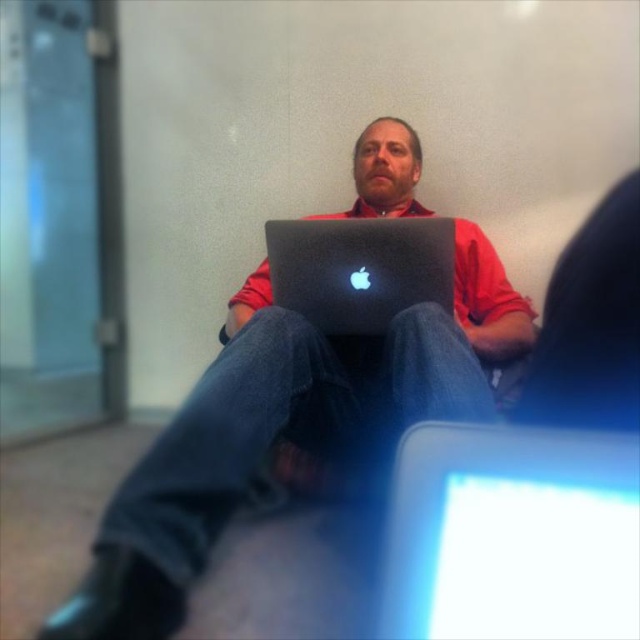
Is matte black laptop at center below satin black laptop at center?

Yes, matte black laptop at center is below satin black laptop at center.

Between matte black laptop at center and satin black laptop at center, which one appears on the right side from the viewer's perspective?

From the viewer's perspective, satin black laptop at center appears more on the right side.

Which is behind, point (234, 364) or point (308, 253)?

The point (308, 253) is behind.

Locate an element on the screen. Image resolution: width=640 pixels, height=640 pixels. matte black laptop at center is located at coordinates (282, 429).

Can you confirm if matte black laptop at center is taller than sleek silver laptop at center?

Indeed, matte black laptop at center has a greater height compared to sleek silver laptop at center.

Describe the element at coordinates (282, 429) in the screenshot. I see `matte black laptop at center` at that location.

Is point (84, 609) behind point (522, 467)?

Yes, point (84, 609) is behind point (522, 467).

Where is `matte black laptop at center`? This screenshot has width=640, height=640. matte black laptop at center is located at coordinates (282, 429).

Looking at this image, how far apart are sleek silver laptop at center and satin black laptop at center?

sleek silver laptop at center and satin black laptop at center are 1.00 meters apart from each other.

Find the location of a particular element. The width and height of the screenshot is (640, 640). sleek silver laptop at center is located at coordinates (512, 532).

At what (x,y) coordinates should I click in order to perform the action: click on sleek silver laptop at center. Please return your answer as a coordinate pair (x, y). The width and height of the screenshot is (640, 640). Looking at the image, I should click on (512, 532).